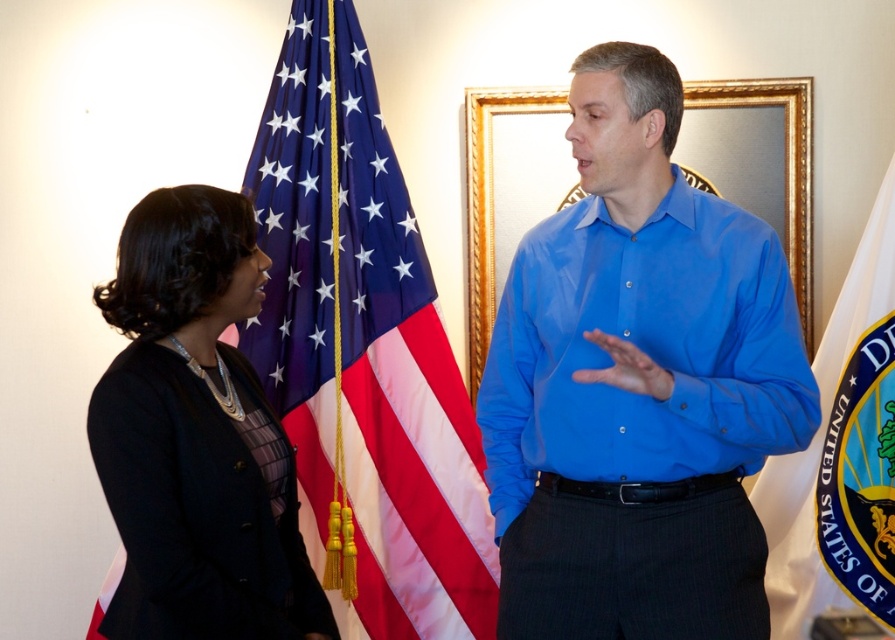
Who is lower down, blue smooth shirt at center or black fabric jacket at left?

black fabric jacket at left

Is point (499, 509) closer to camera compared to point (173, 458)?

No, (499, 509) is further to viewer.

The image size is (895, 640). I want to click on blue smooth shirt at center, so click(x=638, y=385).

Is point (658, 634) closer to camera compared to point (840, 362)?

Yes, it is.

Is point (558, 433) positioned behind point (875, 211)?

No, it is not.

Identify the location of blue smooth shirt at center. (638, 385).

Can you confirm if black fabric jacket at left is taller than white fabric flag at right?

No, black fabric jacket at left is not taller than white fabric flag at right.

Which of these two, black fabric jacket at left or white fabric flag at right, stands taller?

white fabric flag at right is taller.

Image resolution: width=895 pixels, height=640 pixels. What do you see at coordinates (195, 436) in the screenshot?
I see `black fabric jacket at left` at bounding box center [195, 436].

Where is `black fabric jacket at left`? black fabric jacket at left is located at coordinates (195, 436).